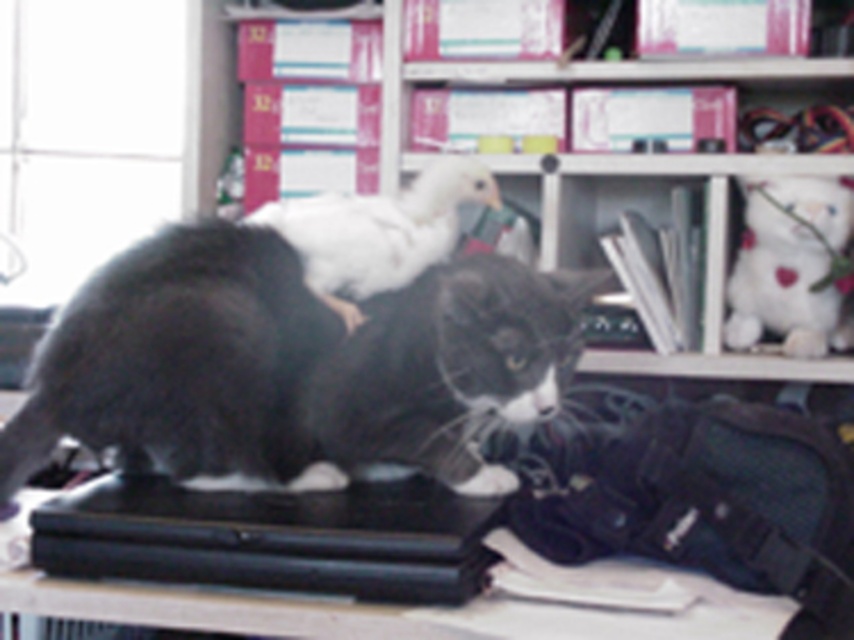
Question: Which of the following is the closest to the observer?

Choices:
 (A) white plush toy at upper right
 (B) white fluffy duckling at center
 (C) black fur cat at center
 (D) black matte laptop at center

Answer: (D)

Question: In this image, where is black matte laptop at center located relative to white plush toy at upper right?

Choices:
 (A) right
 (B) left

Answer: (B)

Question: Is the position of white fluffy duckling at center less distant than that of white plush toy at upper right?

Choices:
 (A) no
 (B) yes

Answer: (B)

Question: Which object is positioned closest to the black fur cat at center?

Choices:
 (A) pink cardboard boxes at upper center
 (B) white plush toy at upper right

Answer: (A)

Question: Does black fur cat at center lie behind white plush toy at upper right?

Choices:
 (A) no
 (B) yes

Answer: (A)

Question: Estimate the real-world distances between objects in this image. Which object is farther from the pink cardboard boxes at upper center?

Choices:
 (A) black matte laptop at center
 (B) white fluffy duckling at center
 (C) black fur cat at center
 (D) white plush toy at upper right

Answer: (A)